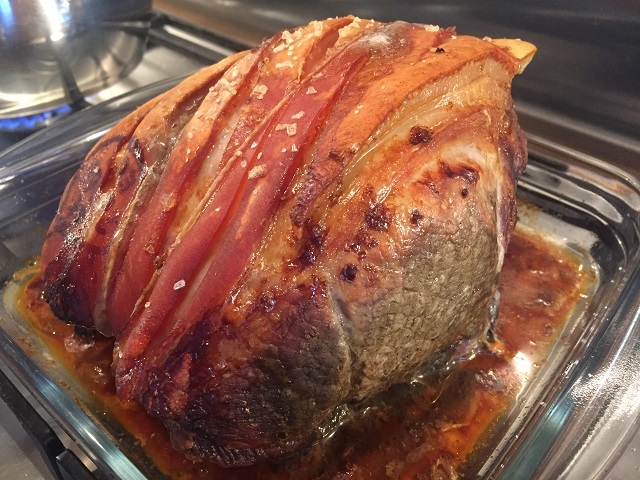
Locate instances of where i'd cook in the image. Your answer should be formatted as a list of tuples, i.e. [(x1, y1), (x2, y2), ...], where each tuple contains the x and y coordinates of a point satisfying the conditions above.

[(45, 114), (148, 86), (586, 287), (51, 155)]